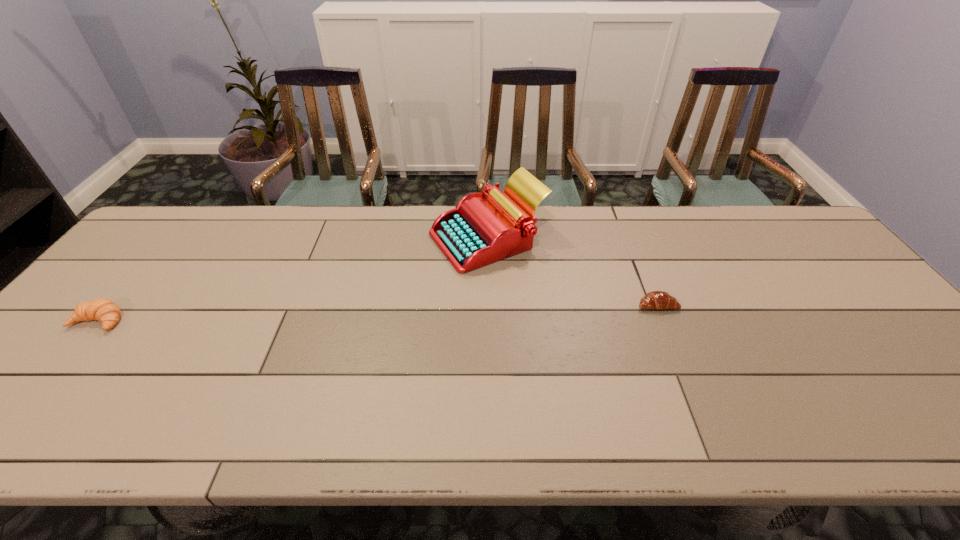
I want to click on the second object from right to left, so click(x=477, y=232).

Identify the location of the tallest object. The image size is (960, 540). [x=477, y=232].

Where is `the taller crescent roll`? The height and width of the screenshot is (540, 960). the taller crescent roll is located at coordinates 104,310.

Identify the location of the second shortest object. This screenshot has height=540, width=960. (104, 310).

In order to click on the shorter crescent roll in this screenshot , I will do `click(660, 300)`.

At what (x,y) coordinates should I click in order to perform the action: click on the right crescent roll. Please return your answer as a coordinate pair (x, y). This screenshot has height=540, width=960. Looking at the image, I should click on (660, 300).

Identify the location of vacant space situated on the typing side of the typewriter. (383, 239).

This screenshot has width=960, height=540. Identify the location of vacant space situated on the typing side of the typewriter. (399, 239).

Where is `vacant space located 0.260m on the typing side of the typewriter`? vacant space located 0.260m on the typing side of the typewriter is located at coordinates (345, 239).

Identify the location of free space located on the front of the left crescent roll. This screenshot has height=540, width=960. (44, 386).